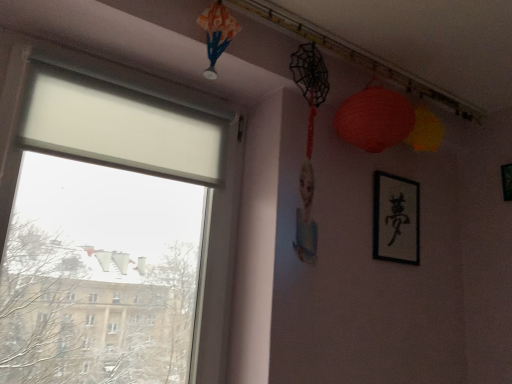
Question: Is point (408, 120) closer or farther from the camera than point (510, 173)?

Choices:
 (A) farther
 (B) closer

Answer: (B)

Question: Is matte paper lantern at upper right in front of or behind black matte picture frame at upper right, the 2th picture frame in the left-to-right sequence, in the image?

Choices:
 (A) behind
 (B) front

Answer: (B)

Question: Estimate the real-world distances between objects in this image. Which object is closer to the black matte picture frame at upper right, the 1th picture frame when ordered from right to left?

Choices:
 (A) matte paper lantern at upper right
 (B) black paper at upper right, the first picture frame when ordered from left to right

Answer: (B)

Question: Which object is positioned closest to the black matte picture frame at upper right, the 2th picture frame in the left-to-right sequence?

Choices:
 (A) matte paper lantern at upper right
 (B) black paper at upper right, the first picture frame when ordered from left to right

Answer: (B)